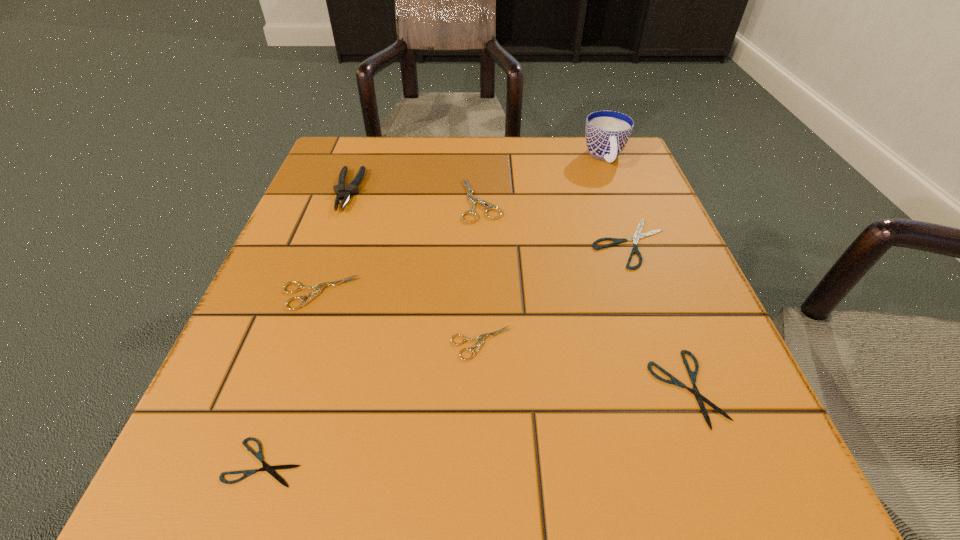
Locate an element on the screen. free space at the far edge of the desktop is located at coordinates (432, 150).

You are a GUI agent. You are given a task and a screenshot of the screen. Output one action in this format:
    pyautogui.click(x=<x>, y=<y>)
    Task: Click on the vacant region at the near edge of the desktop
    The image size is (960, 540).
    Given the screenshot: What is the action you would take?
    pyautogui.click(x=628, y=451)

In the image, there is a desktop. At what (x,y) coordinates should I click in order to perform the action: click on free space at the left edge. Please return your answer as a coordinate pair (x, y). The image size is (960, 540). Looking at the image, I should click on (259, 299).

Locate an element on the screen. The height and width of the screenshot is (540, 960). vacant space at the right edge is located at coordinates (611, 340).

The width and height of the screenshot is (960, 540). In the image, there is a desktop. Identify the location of vacant space at the far left corner. (385, 191).

You are a GUI agent. You are given a task and a screenshot of the screen. Output one action in this format:
    pyautogui.click(x=<x>, y=<y>)
    Task: Click on the vacant space at the far right corner
    The height and width of the screenshot is (540, 960).
    Given the screenshot: What is the action you would take?
    pyautogui.click(x=581, y=141)

Locate an element on the screen. The width and height of the screenshot is (960, 540). free area in between the nearest beige shears and the tallest object is located at coordinates (542, 250).

Find the location of a particular element. free spot between the smallest beige shears and the second biggest black shears is located at coordinates (584, 366).

I want to click on unoccupied area between the second nearest beige shears and the nearest beige shears, so click(400, 318).

Where is `free space between the gray pliers and the sixth shortest object`? free space between the gray pliers and the sixth shortest object is located at coordinates (415, 195).